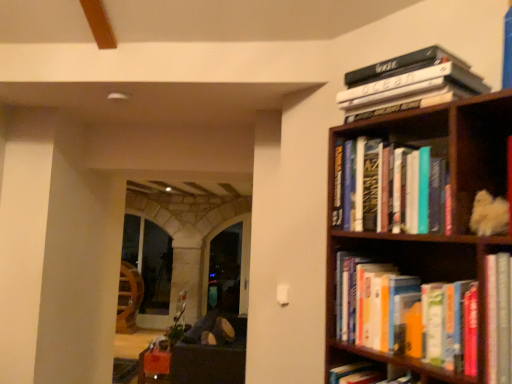
Question: Does transparent glass door at center lie in front of dark brown leather couch at lower left?

Choices:
 (A) no
 (B) yes

Answer: (A)

Question: Can you confirm if transparent glass door at center is smaller than dark brown leather couch at lower left?

Choices:
 (A) no
 (B) yes

Answer: (B)

Question: Is dark brown leather couch at lower left at the back of transparent glass door at center?

Choices:
 (A) no
 (B) yes

Answer: (A)

Question: Does transparent glass door at center turn towards dark brown leather couch at lower left?

Choices:
 (A) no
 (B) yes

Answer: (B)

Question: From a real-world perspective, is transparent glass door at center located beneath dark brown leather couch at lower left?

Choices:
 (A) no
 (B) yes

Answer: (A)

Question: Does transparent glass door at center have a greater height compared to dark brown leather couch at lower left?

Choices:
 (A) no
 (B) yes

Answer: (B)

Question: From a real-world perspective, is hardcover books at upper right, which is counted as the 3th book, starting from the bottom, below hardcover books at right, which is counted as the 1th book, starting from the bottom?

Choices:
 (A) no
 (B) yes

Answer: (A)

Question: Can you confirm if hardcover books at upper right, the 1th book viewed from the top, is shorter than hardcover books at right, marked as the 3th book in a top-to-bottom arrangement?

Choices:
 (A) no
 (B) yes

Answer: (B)

Question: Does hardcover books at upper right, the 1th book viewed from the top, lie behind hardcover books at right, which is counted as the 1th book, starting from the bottom?

Choices:
 (A) no
 (B) yes

Answer: (B)

Question: Is hardcover books at upper right, the 1th book viewed from the top, to the right of hardcover books at right, which is counted as the 1th book, starting from the bottom, from the viewer's perspective?

Choices:
 (A) no
 (B) yes

Answer: (B)

Question: Is hardcover books at upper right, which is counted as the 3th book, starting from the bottom, smaller than hardcover books at right, marked as the 3th book in a top-to-bottom arrangement?

Choices:
 (A) no
 (B) yes

Answer: (A)

Question: Is hardcover books at upper right, the 1th book viewed from the top, aimed at hardcover books at right, which is counted as the 1th book, starting from the bottom?

Choices:
 (A) no
 (B) yes

Answer: (A)

Question: Is hardcover books at upper right, acting as the second book starting from the top, looking in the opposite direction of hardcover books at right, which is counted as the 1th book, starting from the bottom?

Choices:
 (A) no
 (B) yes

Answer: (A)